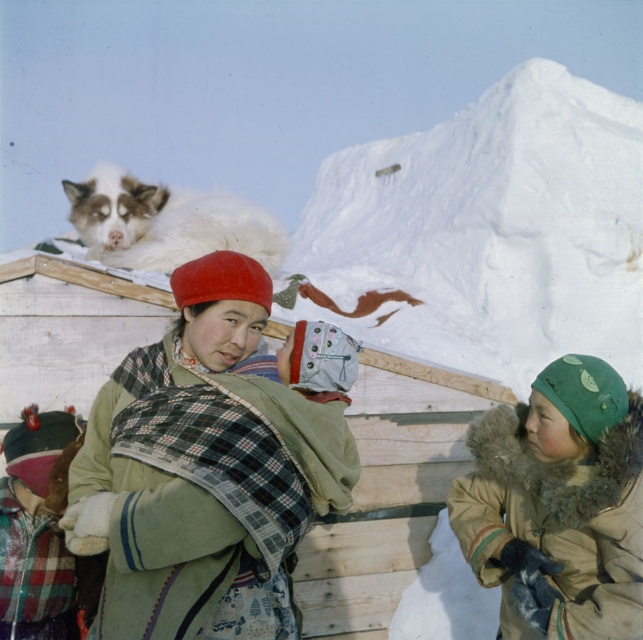
You are an observer standing in the winter scene. You notice the green woolen scarf at center and the white fluffy cat at upper left. Which object is located higher in the image?

The white fluffy cat at upper left is higher in the image than the green woolen scarf at center.

You are standing at the point marked by the coordinates point (557, 506) in the winter scene. Looking around, you see a dog on a wooden structure and an adult wearing a red hat and green jacket. Which direction should you face to see the green fur lined coat at lower right?

The point (557, 506) is where the green fur lined coat at lower right is located, so you are already facing it.